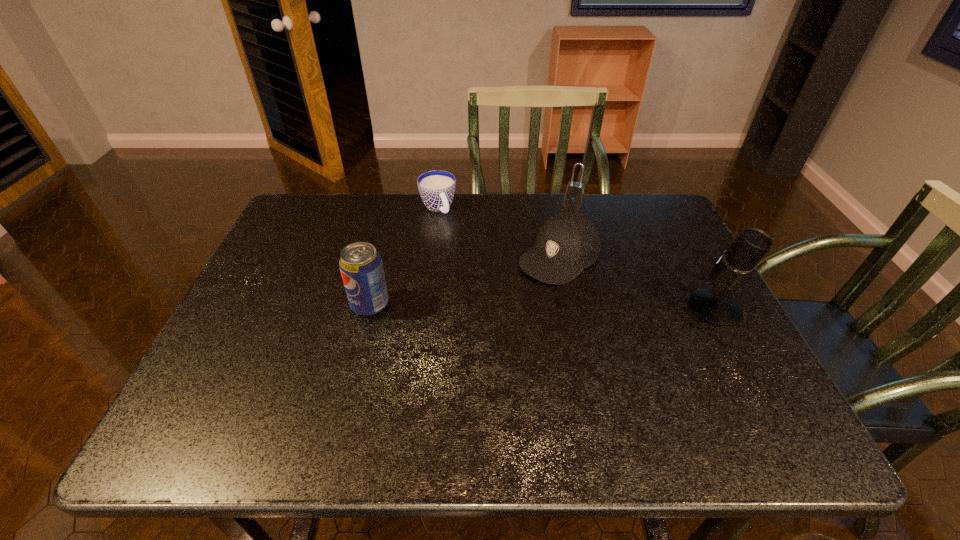
I want to click on vacant space on the desktop that is between the soda and the rightmost object and is positioned on the front-facing side of the third farthest object, so click(x=497, y=306).

Locate an element on the screen. The width and height of the screenshot is (960, 540). free spot on the desktop that is between the leftmost object and the microphone and is positioned on the side of the cup with the handle is located at coordinates (498, 306).

The height and width of the screenshot is (540, 960). I want to click on free space on the desktop that is between the fourth shortest object and the tallest object and is positioned on the shackle of the padlock, so click(527, 306).